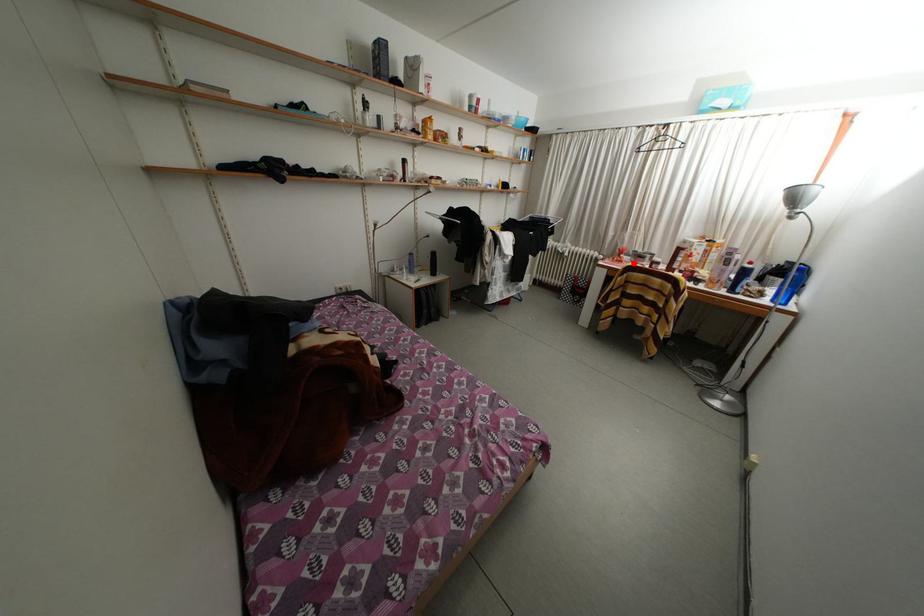
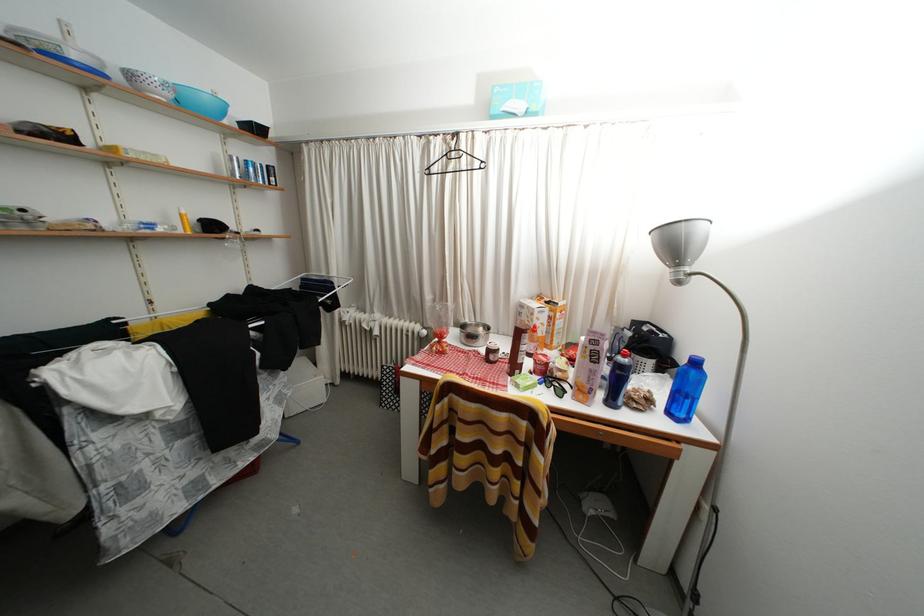
Locate, in the second image, the point that corresponds to the highlighted location in the first image.

(460, 342)